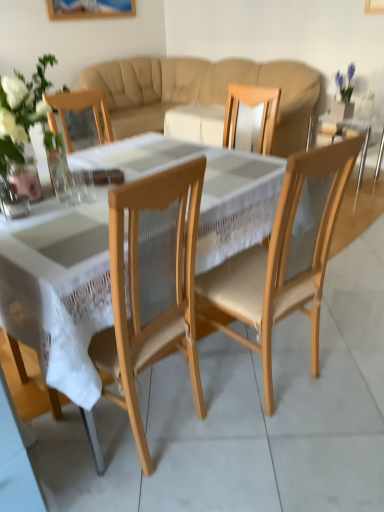
This screenshot has width=384, height=512. In order to click on vacant region to the right of clear glass vase at left in this screenshot , I will do `click(71, 199)`.